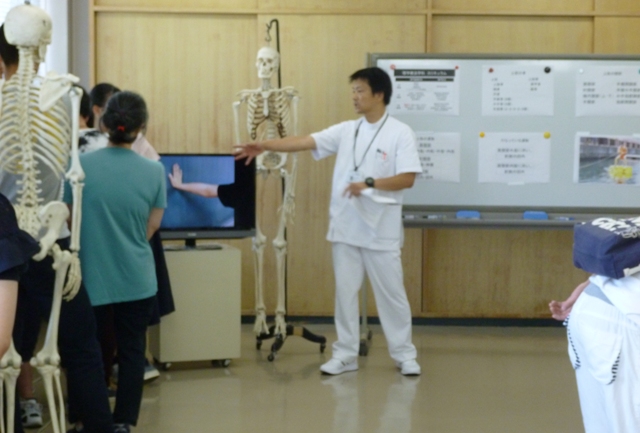
Where is `white sheet`? white sheet is located at coordinates (588, 314).